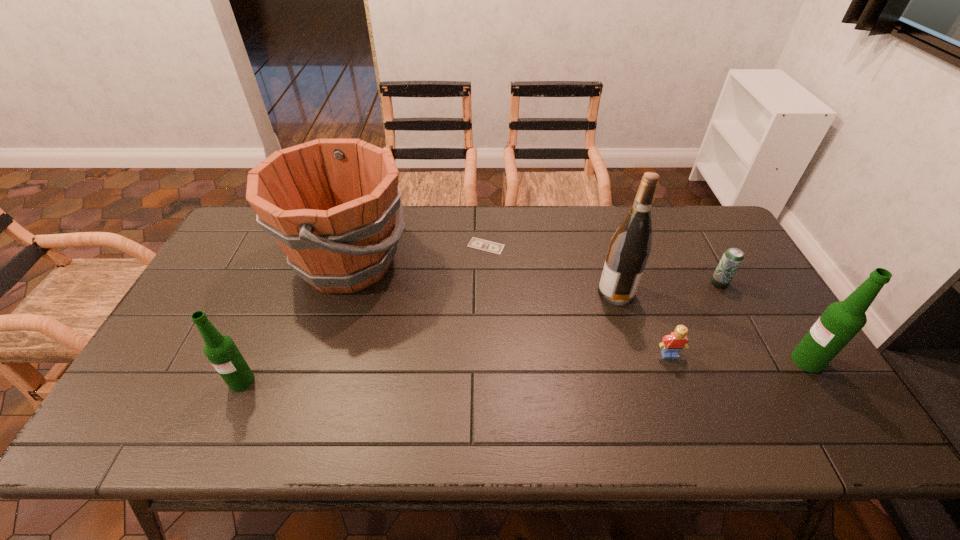
I want to click on the shortest object, so click(x=476, y=243).

Where is `vacant space situated on the label of the right beer bottle`? vacant space situated on the label of the right beer bottle is located at coordinates (773, 361).

Locate an element on the screen. The width and height of the screenshot is (960, 540). free spot located on the label of the right beer bottle is located at coordinates tap(749, 361).

Locate an element on the screen. free location located on the label of the right beer bottle is located at coordinates (765, 361).

At what (x,y) coordinates should I click in order to perform the action: click on free spot located on the handle side of the bucket. Please return your answer as a coordinate pair (x, y). The height and width of the screenshot is (540, 960). Looking at the image, I should click on (523, 262).

Identify the location of free location located 0.210m on the front of the tallest object. The image size is (960, 540). (639, 368).

Locate an element on the screen. Image resolution: width=960 pixels, height=540 pixels. free space located on the left of the second object from right to left is located at coordinates (690, 284).

Locate an element on the screen. This screenshot has height=540, width=960. vacant space situated on the front-facing side of the fifth object from left to right is located at coordinates (684, 394).

What are the coordinates of `vacant area located 0.070m on the front of the money` in the screenshot? It's located at (487, 270).

Where is `bucket located in the far edge section of the desktop`? bucket located in the far edge section of the desktop is located at coordinates (331, 204).